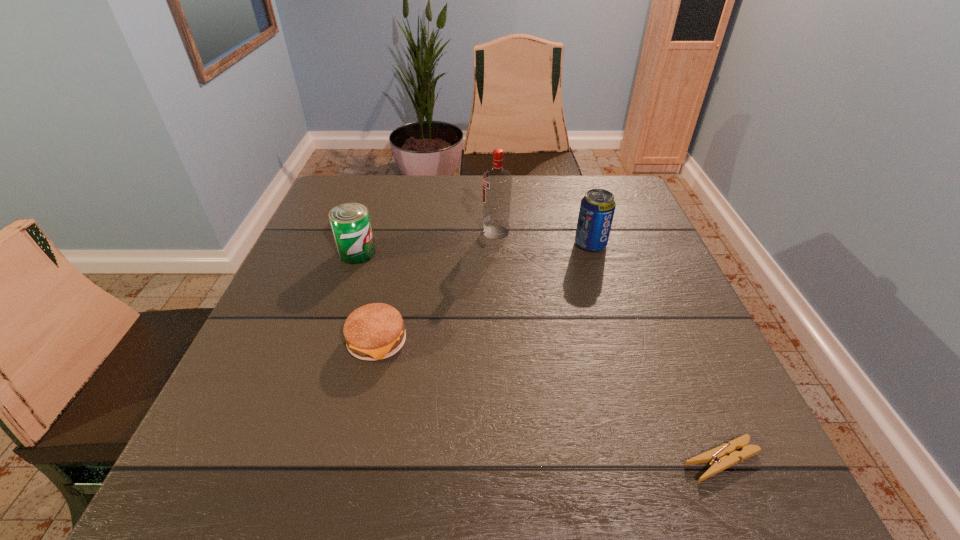
The image size is (960, 540). Identify the location of free space at the far edge. (579, 207).

The width and height of the screenshot is (960, 540). In the image, there is a desktop. What are the coordinates of `free space at the near edge` in the screenshot? It's located at (482, 491).

The height and width of the screenshot is (540, 960). What are the coordinates of `free space at the left edge of the desktop` in the screenshot? It's located at (308, 330).

Locate an element on the screen. This screenshot has width=960, height=540. free space at the right edge is located at coordinates (671, 284).

Find the location of `free space at the far left corner`. free space at the far left corner is located at coordinates (324, 196).

Where is `free space at the near left corner`? The width and height of the screenshot is (960, 540). free space at the near left corner is located at coordinates (280, 475).

In the image, there is a desktop. Identify the location of free space at the near right corner. The width and height of the screenshot is (960, 540). (794, 500).

This screenshot has width=960, height=540. Find the location of `unoccupied area between the shortest object and the vodka`. unoccupied area between the shortest object and the vodka is located at coordinates (609, 346).

The width and height of the screenshot is (960, 540). In order to click on empty space between the fourth shortest object and the nearest object in this screenshot , I will do `click(656, 353)`.

Where is `free space between the third shortest object and the hamburger`? free space between the third shortest object and the hamburger is located at coordinates (367, 298).